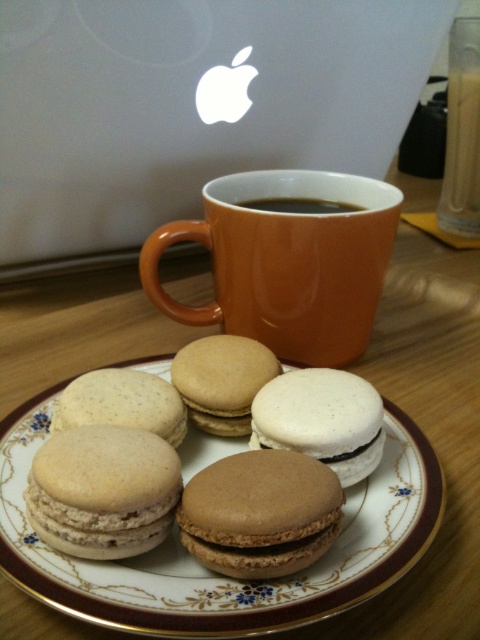
Between matte beige macaron at lower left and brown matte macaron at center, which one is positioned lower?

brown matte macaron at center is below.

Does matte beige macaron at lower left appear on the right side of brown matte macaron at center?

No, matte beige macaron at lower left is not to the right of brown matte macaron at center.

Who is more distant from viewer, (132, 524) or (257, 515)?

The point (132, 524) is more distant.

You are a GUI agent. You are given a task and a screenshot of the screen. Output one action in this format:
    pyautogui.click(x=<x>, y=<y>)
    Task: Click on the matte beige macaron at lower left
    This screenshot has width=480, height=640.
    Given the screenshot: What is the action you would take?
    pyautogui.click(x=103, y=492)

Identify the location of matte brown macarons at center. The image size is (480, 640). (219, 573).

Consider the image. Is matte brown macarons at center closer to the viewer compared to matte beige macaron at lower left?

Yes, matte brown macarons at center is in front of matte beige macaron at lower left.

Which is in front, point (332, 612) or point (60, 496)?

Positioned in front is point (332, 612).

Where is `matte brown macarons at center`? matte brown macarons at center is located at coordinates (219, 573).

Between matte brown macaron at center and brown matte coffee at upper center, which one has less height?

brown matte coffee at upper center is shorter.

Which is in front, point (229, 424) or point (285, 202)?

Point (229, 424) is more forward.

Where is `matte brown macaron at center`? The width and height of the screenshot is (480, 640). matte brown macaron at center is located at coordinates (222, 380).